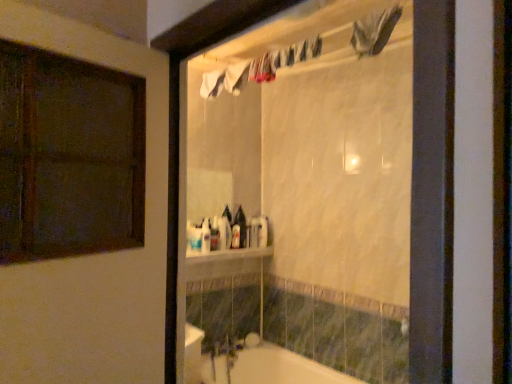
Measure the distance between white glossy bottle at center, which is counted as the 5th toiletry, starting from the left, and camera.

9.68 feet.

Find the location of `white glossy bottle at center, which appears as the fifth toiletry when viewed from the front`. white glossy bottle at center, which appears as the fifth toiletry when viewed from the front is located at coordinates (262, 231).

This screenshot has height=384, width=512. Describe the element at coordinates (253, 232) in the screenshot. I see `translucent plastic container at center, the second toiletry when ordered from back to front` at that location.

In order to face translucent plastic bottle at upper center, the second toiletry viewed from the left, should I rotate leftwards or rightwards?

Turn left approximately 6.861 degrees to face it.

How much space does translucent plastic bottle at upper center, the 4th toiletry viewed from the back, occupy horizontally?

translucent plastic bottle at upper center, the 4th toiletry viewed from the back, is 2.43 inches in width.

The height and width of the screenshot is (384, 512). Identify the location of white glossy mirror at upper center. (305, 198).

Locate an element on the screen. The height and width of the screenshot is (384, 512). white glossy bottle at center, which is counted as the 5th toiletry, starting from the left is located at coordinates (262, 231).

From a real-world perspective, who is located higher, translucent plastic container at center, the 4th toiletry when ordered from left to right, or white glossy bathtub at lower center?

From a 3D spatial view, translucent plastic container at center, the 4th toiletry when ordered from left to right, is above.

Between translucent plastic container at center, the second toiletry when ordered from back to front, and white glossy bathtub at lower center, which one has smaller width?

translucent plastic container at center, the second toiletry when ordered from back to front, is thinner.

Who is shorter, translucent plastic container at center, which is counted as the 4th toiletry, starting from the front, or white glossy bathtub at lower center?

With less height is translucent plastic container at center, which is counted as the 4th toiletry, starting from the front.

Is point (257, 227) in front of point (266, 369)?

No, it is behind (266, 369).

How much distance is there between white glossy shelf at center and white plastic bottle at center, which is the third toiletry from right to left?

They are 6.34 inches apart.

Which is in front, white glossy shelf at center or white plastic bottle at center, which is the third toiletry from right to left?

white glossy shelf at center.

Can you tell me how much white glossy shelf at center and white plastic bottle at center, placed as the 3th toiletry when sorted from left to right, differ in facing direction?

They differ by 4.96 degrees in their facing directions.

From the image's perspective, is white glossy shelf at center on white plastic bottle at center, acting as the 3th toiletry starting from the back?

No.

Considering the positions of point (280, 223) and point (251, 238), is point (280, 223) closer or farther from the camera than point (251, 238)?

Point (280, 223) appears to be farther away from the viewer than point (251, 238).

Could you tell me if white glossy mirror at upper center is facing translucent plastic container at center, which is counted as the 4th toiletry, starting from the front?

No, white glossy mirror at upper center is not turned towards translucent plastic container at center, which is counted as the 4th toiletry, starting from the front.

From the picture: From a real-world perspective, which is physically above, white glossy mirror at upper center or translucent plastic container at center, the second toiletry when ordered from back to front?

white glossy mirror at upper center.

Considering the relative sizes of translucent plastic container at center, which is counted as the 4th toiletry, starting from the front, and white glossy shelf at center in the image provided, is translucent plastic container at center, which is counted as the 4th toiletry, starting from the front, thinner than white glossy shelf at center?

Yes, translucent plastic container at center, which is counted as the 4th toiletry, starting from the front, is thinner than white glossy shelf at center.

Which is more to the left, translucent plastic container at center, the 4th toiletry when ordered from left to right, or white glossy shelf at center?

Positioned to the left is white glossy shelf at center.

From a real-world perspective, is translucent plastic container at center, which is the 2th toiletry in right-to-left order, under white glossy shelf at center?

Incorrect, from a real-world perspective, translucent plastic container at center, which is the 2th toiletry in right-to-left order, is higher than white glossy shelf at center.

The width and height of the screenshot is (512, 384). What are the coordinates of `balustrade below the translucent plastic container at center, which is counted as the 4th toiletry, starting from the front (from the image's perspective)` in the screenshot? It's located at tap(227, 255).

What's the angular difference between white glossy mirror at upper center and translucent plastic bottle at upper center, the second toiletry viewed from the left,'s facing directions?

The angular difference between white glossy mirror at upper center and translucent plastic bottle at upper center, the second toiletry viewed from the left, is 83.2 degrees.

Could you tell me if white glossy mirror at upper center is facing translucent plastic bottle at upper center, the second toiletry positioned from the front?

No.

Can you see white glossy mirror at upper center touching translucent plastic bottle at upper center, the 4th toiletry viewed from the back?

There is a gap between white glossy mirror at upper center and translucent plastic bottle at upper center, the 4th toiletry viewed from the back.

Would you say white glossy mirror at upper center is inside or outside translucent plastic bottle at upper center, marked as the 4th toiletry in a right-to-left arrangement?

white glossy mirror at upper center is outside translucent plastic bottle at upper center, marked as the 4th toiletry in a right-to-left arrangement.

Is translucent plastic bottle at upper center, the second toiletry positioned from the front, not within white glossy bottle at center, which is the first toiletry from right to left?

translucent plastic bottle at upper center, the second toiletry positioned from the front, lies outside white glossy bottle at center, which is the first toiletry from right to left,'s area.

Does translucent plastic bottle at upper center, the 4th toiletry viewed from the back, turn towards white glossy bottle at center, which is counted as the 5th toiletry, starting from the left?

No, translucent plastic bottle at upper center, the 4th toiletry viewed from the back, does not turn towards white glossy bottle at center, which is counted as the 5th toiletry, starting from the left.

Considering the relative sizes of translucent plastic bottle at upper center, marked as the 4th toiletry in a right-to-left arrangement, and white glossy bottle at center, which is counted as the 5th toiletry, starting from the left, in the image provided, is translucent plastic bottle at upper center, marked as the 4th toiletry in a right-to-left arrangement, smaller than white glossy bottle at center, which is counted as the 5th toiletry, starting from the left,?

Yes, translucent plastic bottle at upper center, marked as the 4th toiletry in a right-to-left arrangement, is smaller than white glossy bottle at center, which is counted as the 5th toiletry, starting from the left.

Does translucent plastic bottle at upper center, the second toiletry positioned from the front, lie in front of white glossy bottle at center, which appears as the fifth toiletry when viewed from the front?

Yes, translucent plastic bottle at upper center, the second toiletry positioned from the front, is in front of white glossy bottle at center, which appears as the fifth toiletry when viewed from the front.

In the image, is translucent plastic bottle at upper center, marked as the 4th toiletry in a right-to-left arrangement, positioned in front of or behind white glossy mirror at upper center?

translucent plastic bottle at upper center, marked as the 4th toiletry in a right-to-left arrangement, is positioned farther from the viewer than white glossy mirror at upper center.

Does translucent plastic bottle at upper center, the second toiletry viewed from the left, appear on the left side of white glossy mirror at upper center?

Correct, you'll find translucent plastic bottle at upper center, the second toiletry viewed from the left, to the left of white glossy mirror at upper center.

Can you confirm if translucent plastic bottle at upper center, the second toiletry viewed from the left, is taller than white glossy mirror at upper center?

Incorrect, the height of translucent plastic bottle at upper center, the second toiletry viewed from the left, is not larger of that of white glossy mirror at upper center.

Find the location of a particular element. The image size is (512, 384). bathtub in front of the translucent plastic container at center, which is counted as the 4th toiletry, starting from the front is located at coordinates (268, 368).

From the white glossy shelf at center, count 3rd toiletrys backward and point to it. Please provide its 2D coordinates.

[(236, 236)]

In the scene shown: Considering their positions, is white glossy mirror at upper center positioned closer to white glossy bottle at center, which is counted as the 5th toiletry, starting from the left, than white plastic bottle at center, acting as the 3th toiletry starting from the back?

Based on the image, white plastic bottle at center, acting as the 3th toiletry starting from the back, appears to be nearer to white glossy bottle at center, which is counted as the 5th toiletry, starting from the left.

Which object lies further to the anchor point white glossy mirror at upper center, white glossy shelf at center or translucent plastic bottle at upper center, marked as the 4th toiletry in a right-to-left arrangement?

The object further to white glossy mirror at upper center is translucent plastic bottle at upper center, marked as the 4th toiletry in a right-to-left arrangement.

Considering their positions, is white glossy mirror at upper center positioned closer to white plastic bottle at center, acting as the 3th toiletry starting from the back, than white glossy bottle at center, which is the first toiletry from right to left?

white glossy bottle at center, which is the first toiletry from right to left, is positioned closer to the anchor white plastic bottle at center, acting as the 3th toiletry starting from the back.

From the image, which object appears to be nearer to white glossy bottle at center, the fifth toiletry from the back, translucent plastic bottle at upper center, the 4th toiletry viewed from the back, or translucent plastic container at center, which is the 2th toiletry in right-to-left order?

Among the two, translucent plastic bottle at upper center, the 4th toiletry viewed from the back, is located nearer to white glossy bottle at center, the fifth toiletry from the back.

From the image, which object appears to be nearer to translucent plastic container at center, which is counted as the 4th toiletry, starting from the front, white glossy bottle at center, which is counted as the first toiletry, starting from the back, or white glossy shelf at center?

white glossy bottle at center, which is counted as the first toiletry, starting from the back, lies closer to translucent plastic container at center, which is counted as the 4th toiletry, starting from the front, than the other object.

Based on their spatial positions, is white glossy mirror at upper center or white plastic bottle at center, arranged as the third toiletry when viewed from the front, further from white glossy bathtub at lower center?

Based on the image, white plastic bottle at center, arranged as the third toiletry when viewed from the front, appears to be further to white glossy bathtub at lower center.

Based on their spatial positions, is white glossy bottle at center, the 1th toiletry in the front-to-back sequence, or white glossy mirror at upper center closer to translucent plastic bottle at upper center, marked as the 4th toiletry in a right-to-left arrangement?

Among the two, white glossy bottle at center, the 1th toiletry in the front-to-back sequence, is located nearer to translucent plastic bottle at upper center, marked as the 4th toiletry in a right-to-left arrangement.

Considering their positions, is white glossy shelf at center positioned closer to white glossy bottle at center, which is the first toiletry from right to left, than white glossy bottle at center, the 1th toiletry in the front-to-back sequence?

white glossy shelf at center.

The image size is (512, 384). Find the location of `balustrade between white glossy mirror at upper center and white glossy bottle at center, which is counted as the 5th toiletry, starting from the left, along the z-axis`. balustrade between white glossy mirror at upper center and white glossy bottle at center, which is counted as the 5th toiletry, starting from the left, along the z-axis is located at coordinates (227, 255).

This screenshot has height=384, width=512. What are the coordinates of `toiletry located between white glossy bottle at center, the fifth toiletry from the back, and white plastic bottle at center, which is the third toiletry from right to left, in the left-right direction` in the screenshot? It's located at (205, 236).

Locate an element on the screen. toiletry between white plastic bottle at center, placed as the 3th toiletry when sorted from left to right, and white glossy bottle at center, which is counted as the first toiletry, starting from the back is located at coordinates (253, 232).

The image size is (512, 384). In order to click on bathtub between white glossy mirror at upper center and translucent plastic bottle at upper center, marked as the 4th toiletry in a right-to-left arrangement, from front to back in this screenshot , I will do `click(268, 368)`.